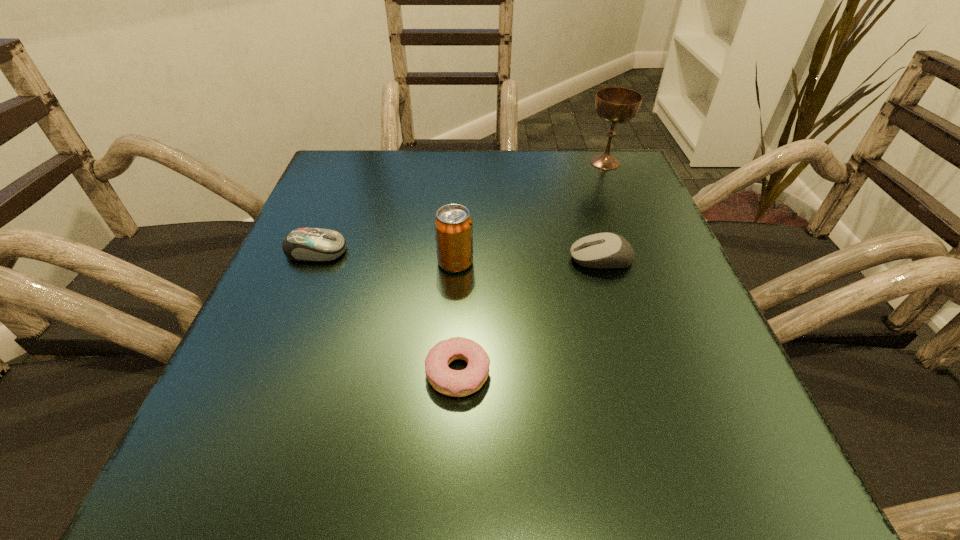
At what (x,y) coordinates should I click in order to perform the action: click on free space located on the wheel side of the right computer mouse. Please return your answer as a coordinate pair (x, y). This screenshot has width=960, height=540. Looking at the image, I should click on (396, 259).

The width and height of the screenshot is (960, 540). In order to click on free spot located on the wheel side of the right computer mouse in this screenshot , I will do `click(510, 259)`.

The height and width of the screenshot is (540, 960). I want to click on free space located 0.330m on the wheel side of the leftmost object, so click(x=523, y=251).

Image resolution: width=960 pixels, height=540 pixels. Find the location of `blank space located 0.340m on the back of the shortest object`. blank space located 0.340m on the back of the shortest object is located at coordinates (465, 214).

I want to click on object at the far edge, so click(x=615, y=105).

You are a GUI agent. You are given a task and a screenshot of the screen. Output one action in this format:
    pyautogui.click(x=<x>, y=<y>)
    Task: Click on the object positioned at the left edge
    The height and width of the screenshot is (540, 960).
    Given the screenshot: What is the action you would take?
    pyautogui.click(x=303, y=244)

Locate an element on the screen. The image size is (960, 540). chalice that is at the right edge is located at coordinates (615, 105).

Identify the location of computer equipment that is at the right edge. This screenshot has width=960, height=540. (602, 250).

What are the coordinates of `object at the far right corner` in the screenshot? It's located at (615, 105).

The height and width of the screenshot is (540, 960). I want to click on free space at the far edge of the desktop, so click(x=476, y=198).